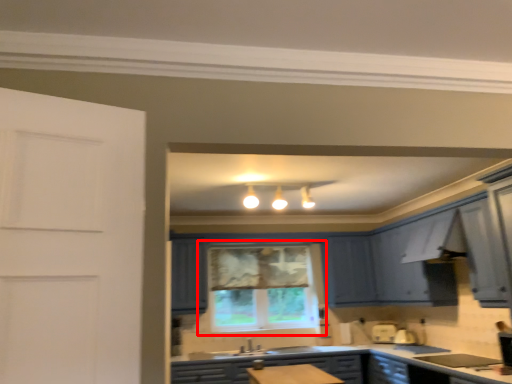
Question: From the image's perspective, where is window (annotated by the red box) located relative to cabinetry?

Choices:
 (A) below
 (B) above

Answer: (B)